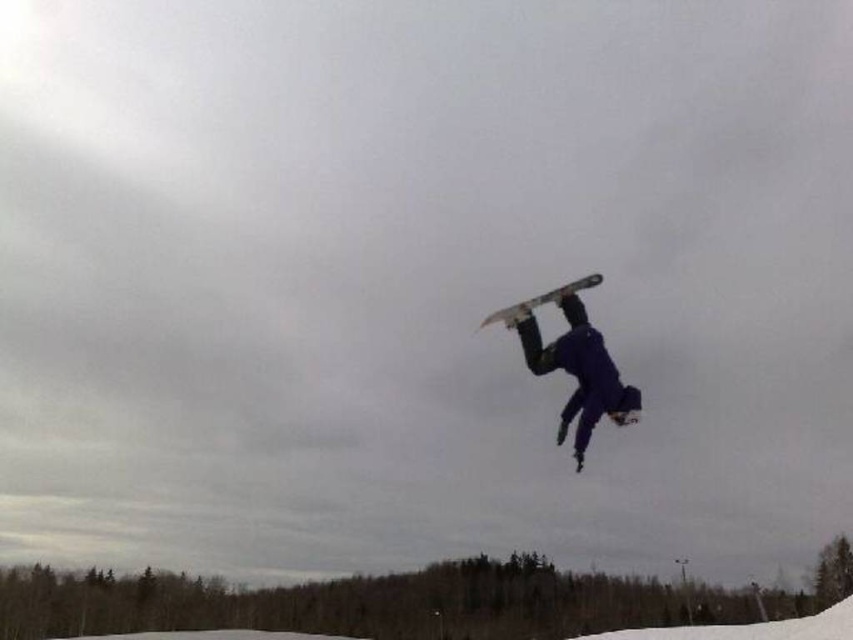
Find the location of a particular element. matte black snowboard at center is located at coordinates (576, 368).

Which is above, matte black snowboard at center or matte gray snowboard at center?

matte gray snowboard at center is above.

Where is `matte black snowboard at center`? The image size is (853, 640). matte black snowboard at center is located at coordinates (576, 368).

Find the location of a particular element. The width and height of the screenshot is (853, 640). matte black snowboard at center is located at coordinates (576, 368).